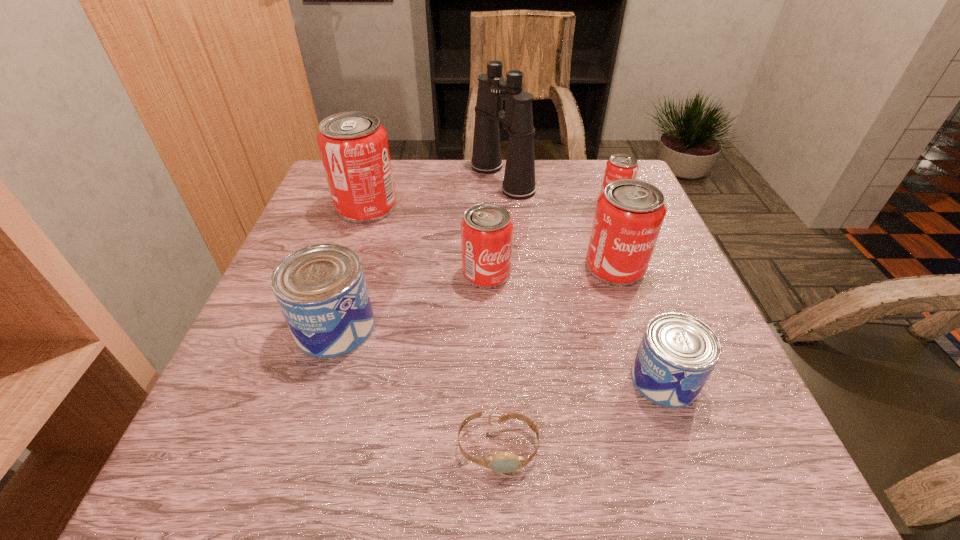
Locate an element on the screen. the nearest object is located at coordinates (505, 462).

Locate an element on the screen. the shortest object is located at coordinates (x=505, y=462).

The image size is (960, 540). I want to click on blank area located on the front of the binoculars, so click(x=509, y=269).

You are a GUI agent. You are given a task and a screenshot of the screen. Output one action in this format:
    pyautogui.click(x=<x>, y=<y>)
    Task: Click on the vacant region located on the back of the second tallest object
    
    Given the screenshot: What is the action you would take?
    pyautogui.click(x=377, y=173)

The width and height of the screenshot is (960, 540). Identify the location of vacant space situated 0.380m on the front of the third tallest object. (686, 479).

You are a GUI agent. You are given a task and a screenshot of the screen. Output one action in this format:
    pyautogui.click(x=<x>, y=<y>)
    Task: Click on the free space located 0.160m on the front of the second red can from left to right
    
    Given the screenshot: What is the action you would take?
    pyautogui.click(x=488, y=354)

At what (x,y) coordinates should I click in order to perform the action: click on free region located on the front label of the left blue can. Please return your answer as a coordinate pair (x, y). Looking at the image, I should click on (418, 328).

Find the location of `vacant space located on the front of the smallest red can`. vacant space located on the front of the smallest red can is located at coordinates (623, 219).

The height and width of the screenshot is (540, 960). Find the location of `vacant space located 0.260m on the front label of the right blue can`. vacant space located 0.260m on the front label of the right blue can is located at coordinates (474, 380).

The height and width of the screenshot is (540, 960). Find the location of `vacant area located 0.370m on the front label of the right blue can`. vacant area located 0.370m on the front label of the right blue can is located at coordinates (407, 380).